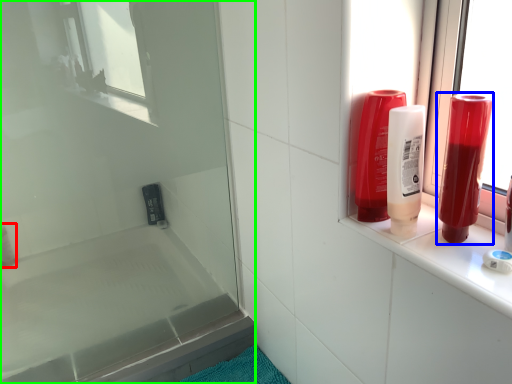
Question: Estimate the real-world distances between objects in this image. Which object is farther from toiletry (highlighted by a red box), mouthwash (highlighted by a blue box) or screen door (highlighted by a green box)?

Choices:
 (A) mouthwash
 (B) screen door

Answer: (A)